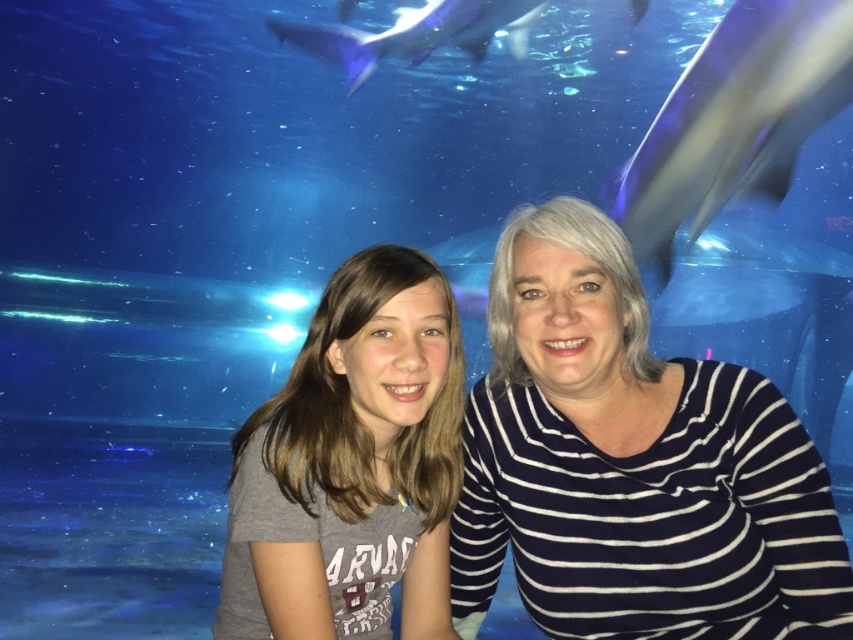
Question: Can you confirm if gray smooth shark at upper right is positioned above blue smooth shark at upper center?

Choices:
 (A) yes
 (B) no

Answer: (B)

Question: Which of these objects is positioned farthest from the gray smooth shark at upper right?

Choices:
 (A) blue smooth shark at upper center
 (B) gray matte shirt at center

Answer: (B)

Question: Among these points, which one is nearest to the camera?

Choices:
 (A) (419, 292)
 (B) (712, 134)
 (C) (436, 1)
 (D) (688, 362)

Answer: (A)

Question: Can you confirm if white striped shirt at center is positioned above gray matte shirt at center?

Choices:
 (A) yes
 (B) no

Answer: (B)

Question: Is the position of white striped shirt at center more distant than that of blue smooth shark at upper center?

Choices:
 (A) no
 (B) yes

Answer: (A)

Question: Which is nearer to the blue smooth shark at upper center?

Choices:
 (A) gray smooth shark at upper right
 (B) white striped shirt at center
 (C) gray matte shirt at center

Answer: (A)